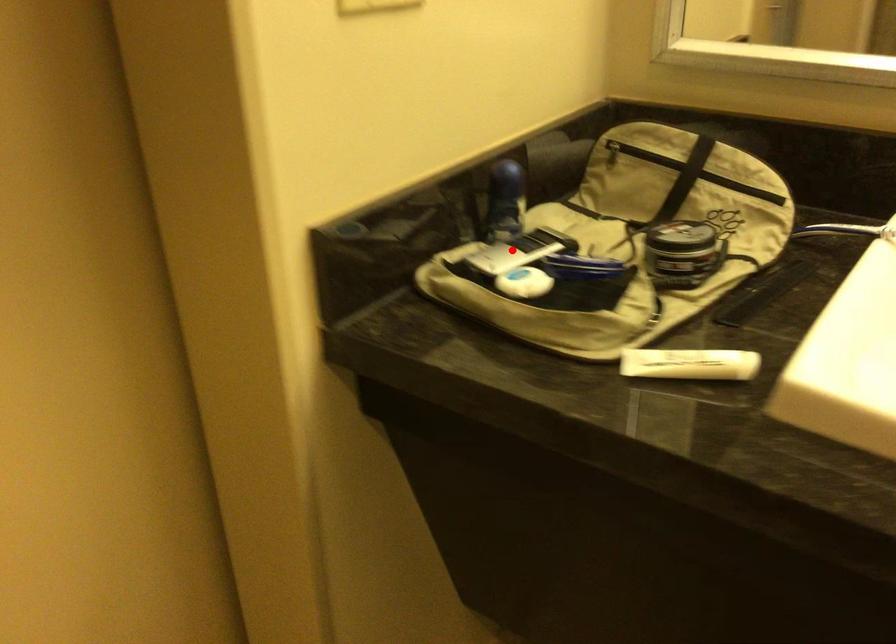
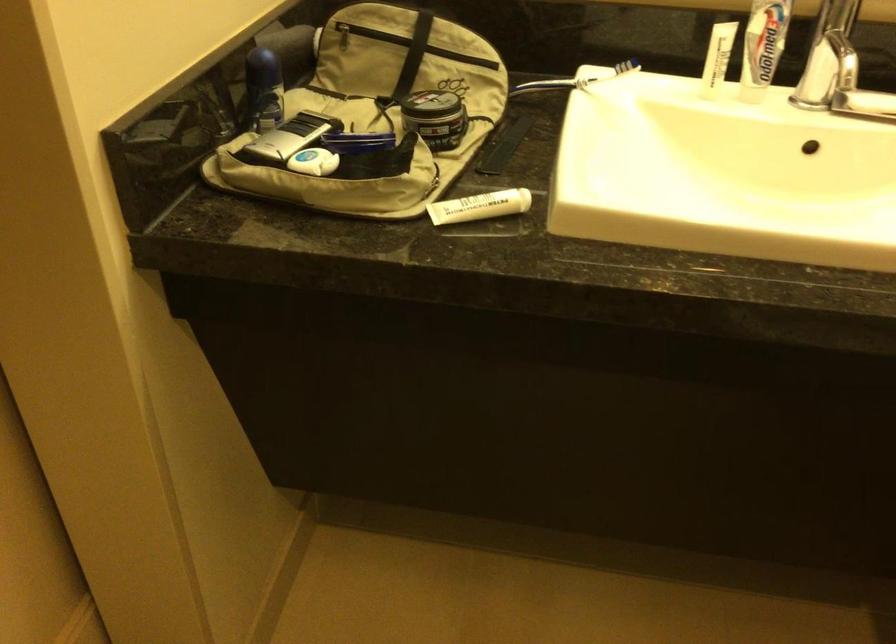
The point at the highlighted location is marked in the first image. Where is the corresponding point in the second image?

(288, 137)